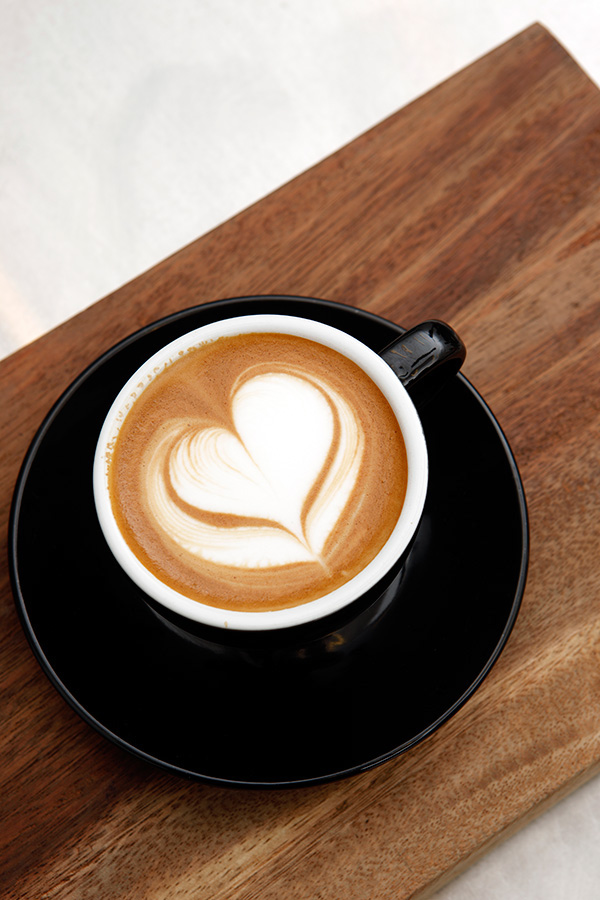
In order to click on table in this screenshot , I will do `click(416, 798)`.